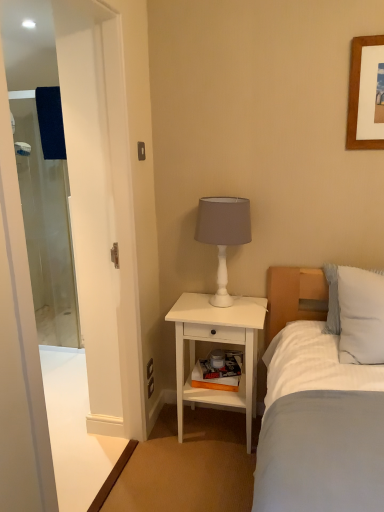
Question: Is the position of white striped pillow at right less distant than that of white matte table lamp at upper right?

Choices:
 (A) yes
 (B) no

Answer: (A)

Question: Considering the relative positions of white striped pillow at right and white matte table lamp at upper right in the image provided, is white striped pillow at right to the left of white matte table lamp at upper right from the viewer's perspective?

Choices:
 (A) yes
 (B) no

Answer: (B)

Question: Is the depth of white striped pillow at right greater than that of white matte table lamp at upper right?

Choices:
 (A) yes
 (B) no

Answer: (B)

Question: Does white striped pillow at right have a greater width compared to white matte table lamp at upper right?

Choices:
 (A) yes
 (B) no

Answer: (A)

Question: Does white striped pillow at right have a greater height compared to white matte table lamp at upper right?

Choices:
 (A) no
 (B) yes

Answer: (A)

Question: Looking at the image, does white matte table lamp at upper right seem bigger or smaller compared to clear glass screen door at left, the 2th screen door in the right-to-left sequence?

Choices:
 (A) big
 (B) small

Answer: (B)

Question: From the image's perspective, relative to clear glass screen door at left, the 2th screen door in the right-to-left sequence, is white matte table lamp at upper right above or below?

Choices:
 (A) below
 (B) above

Answer: (A)

Question: Is white matte table lamp at upper right situated inside clear glass screen door at left, which ranks as the 1th screen door in left-to-right order, or outside?

Choices:
 (A) inside
 (B) outside

Answer: (B)

Question: Is point (221, 247) positioned closer to the camera than point (57, 305)?

Choices:
 (A) farther
 (B) closer

Answer: (B)

Question: From a real-world perspective, relative to white matte table lamp at upper right, is clear glass screen door at left, which is counted as the 2th screen door, starting from the front, vertically above or below?

Choices:
 (A) above
 (B) below

Answer: (B)

Question: In the image, is clear glass screen door at left, which ranks as the 1th screen door in left-to-right order, positioned in front of or behind white matte table lamp at upper right?

Choices:
 (A) front
 (B) behind

Answer: (B)

Question: Is clear glass screen door at left, which is counted as the 2th screen door, starting from the front, taller or shorter than white matte table lamp at upper right?

Choices:
 (A) tall
 (B) short

Answer: (A)

Question: Looking at the image, does clear glass screen door at left, which is counted as the 2th screen door, starting from the front, seem bigger or smaller compared to white matte table lamp at upper right?

Choices:
 (A) small
 (B) big

Answer: (B)

Question: Is white striped pillow at right in front of or behind transparent glass screen door at left, the 2th screen door from the left, in the image?

Choices:
 (A) front
 (B) behind

Answer: (B)

Question: Is white striped pillow at right spatially inside transparent glass screen door at left, acting as the 1th screen door starting from the right, or outside of it?

Choices:
 (A) outside
 (B) inside

Answer: (A)